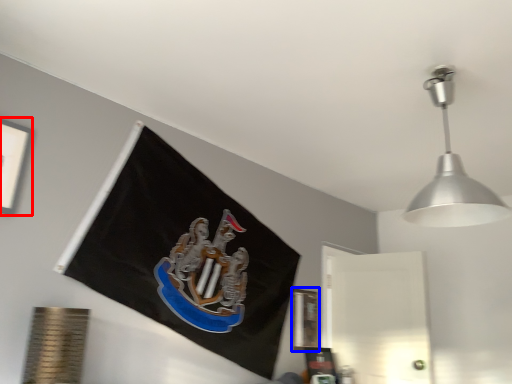
Question: Which object is further to the camera taking this photo, picture frame (highlighted by a red box) or picture frame (highlighted by a blue box)?

Choices:
 (A) picture frame
 (B) picture frame

Answer: (B)